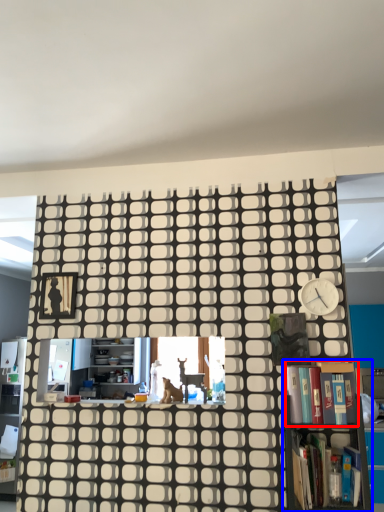
Question: Which point is closer to the camera, book (highlighted by a red box) or bookcase (highlighted by a blue box)?

Choices:
 (A) book
 (B) bookcase

Answer: (B)